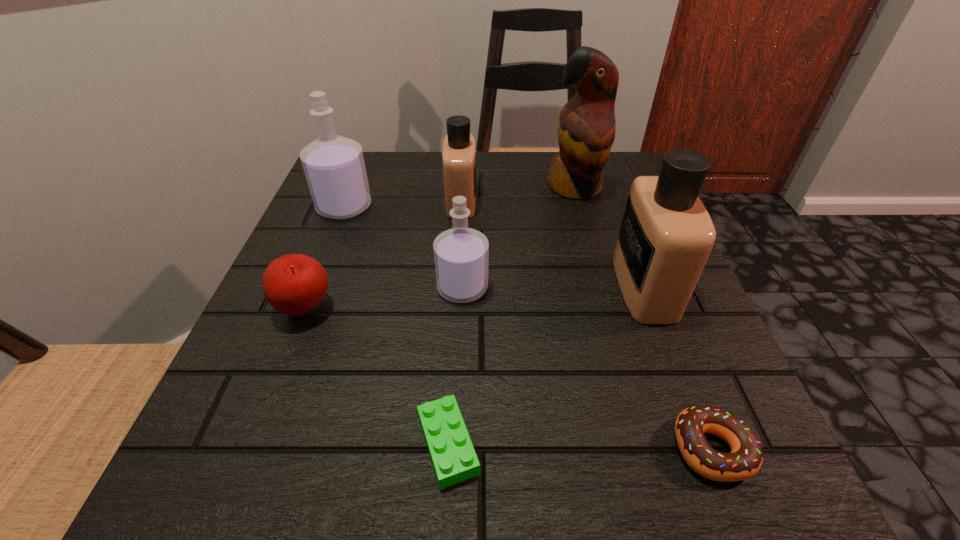
This screenshot has width=960, height=540. I want to click on the tallest object, so click(586, 127).

Locate an element on the screen. parrot is located at coordinates (586, 127).

Where is `the farther purple perfume`? the farther purple perfume is located at coordinates (334, 166).

Locate an element on the screen. This screenshot has height=540, width=960. the left purple perfume is located at coordinates (334, 166).

Identify the location of the bigger beige perfume. (666, 236).

Where is `the rightmost perfume`? Image resolution: width=960 pixels, height=540 pixels. the rightmost perfume is located at coordinates (666, 236).

Find the location of `the smaller beige perfume`. the smaller beige perfume is located at coordinates [459, 147].

Find the location of a particular element. This screenshot has width=960, height=540. the farther beige perfume is located at coordinates (459, 147).

Identify the location of the right purple perfume. (461, 254).

Identify the location of the nearer purple perfume. The image size is (960, 540). (461, 254).